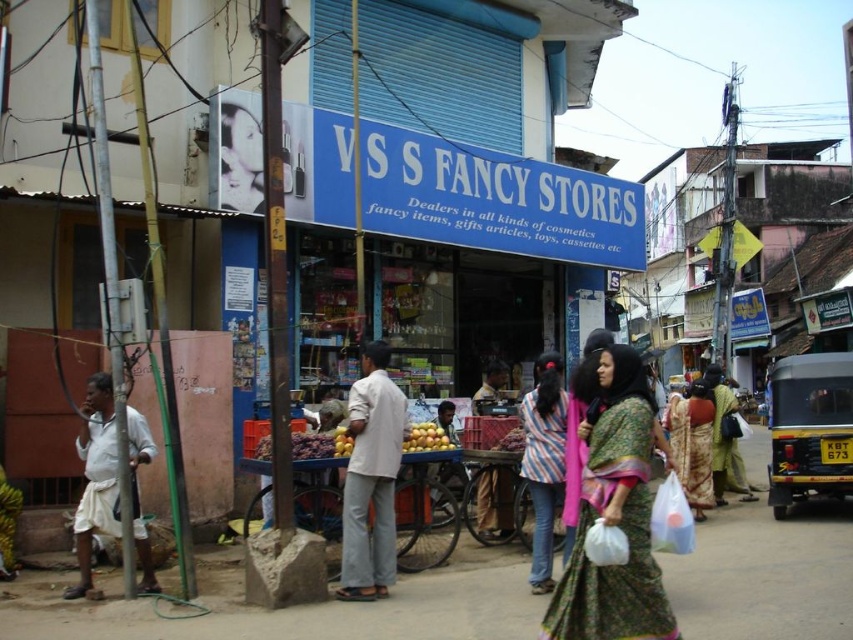
Based on the scene description, where is the green printed sari at center located in terms of coordinates?

The green printed sari at center is located at coordinates point (614, 515).